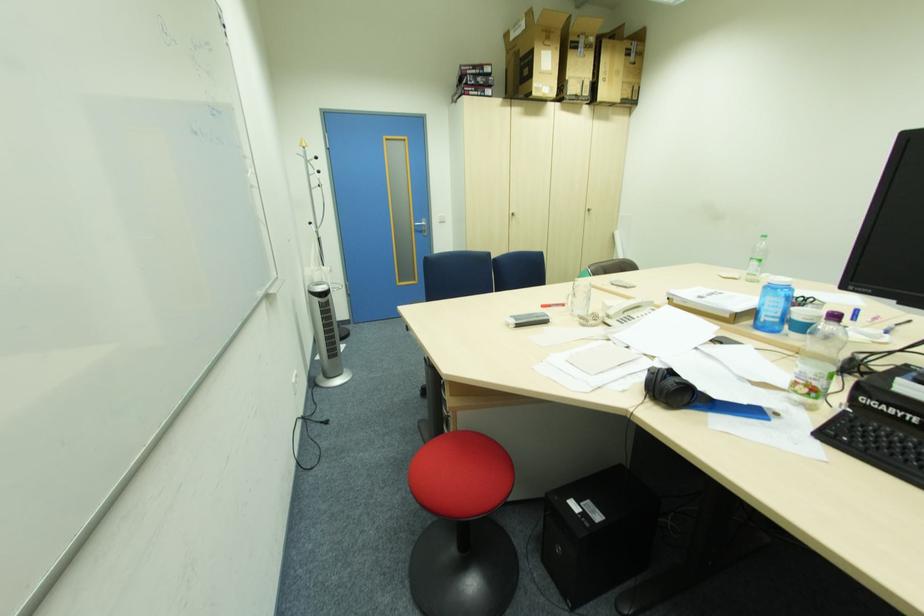
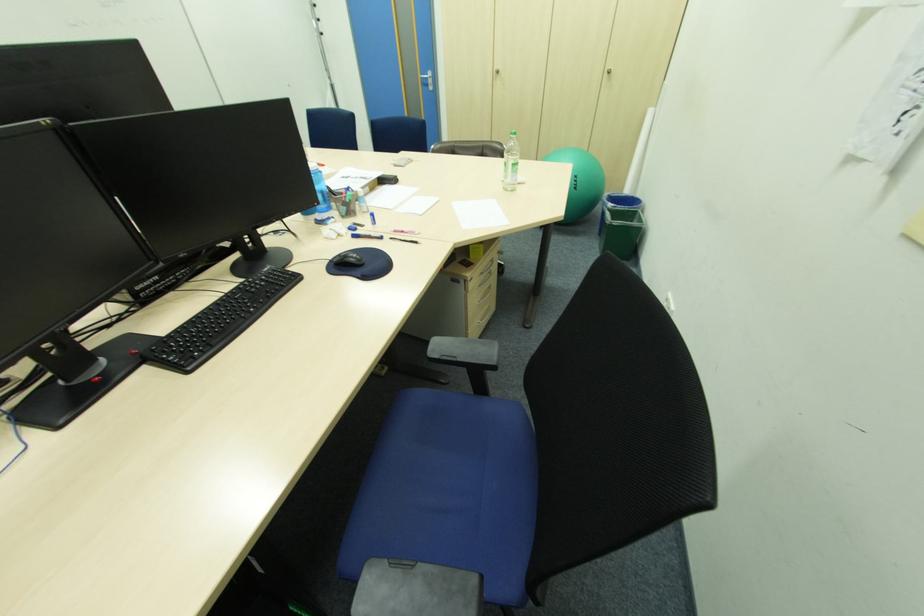
Find the pixel in the second image that matches pixel 594 215 in the first image.

(615, 79)